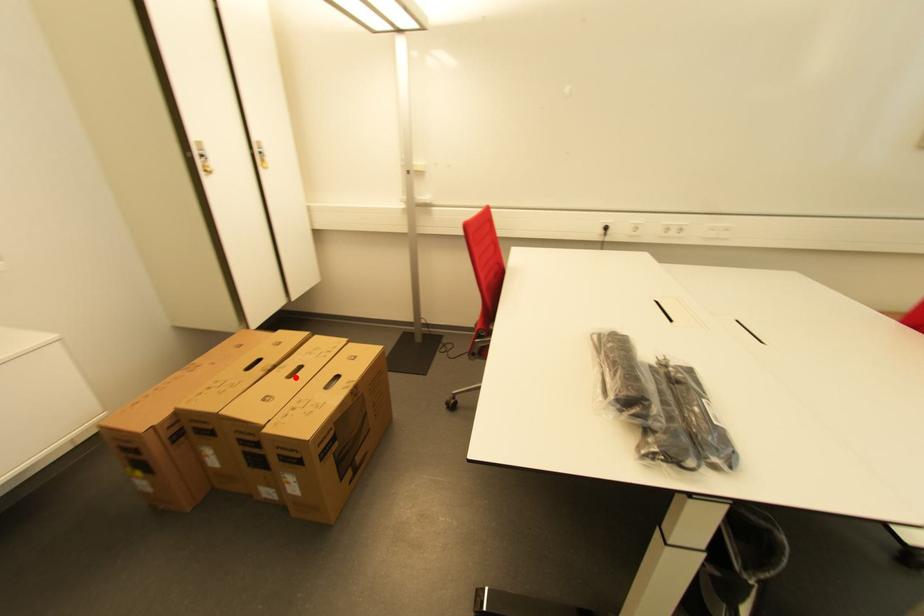
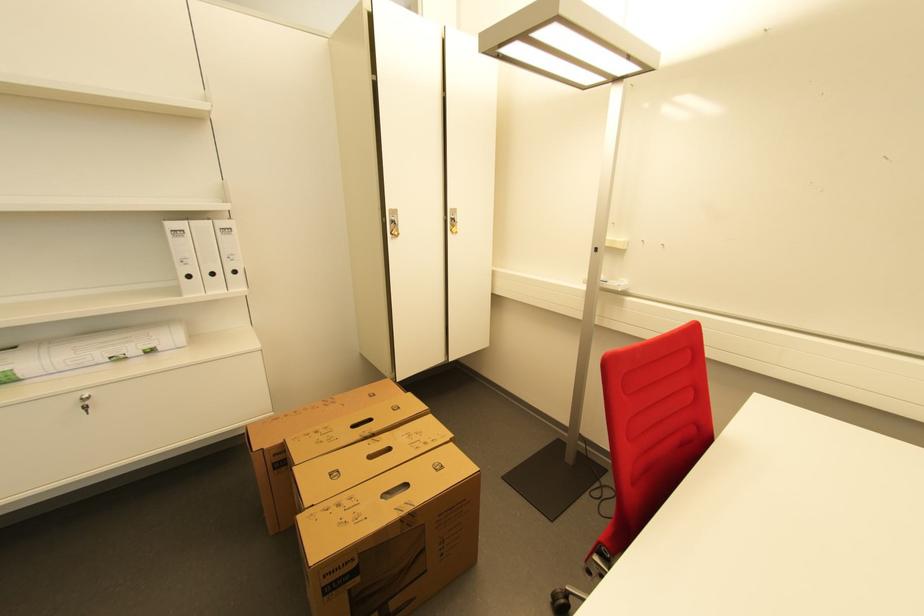
Find the pixel in the second image that matches the highlighted location in the first image.

(377, 458)